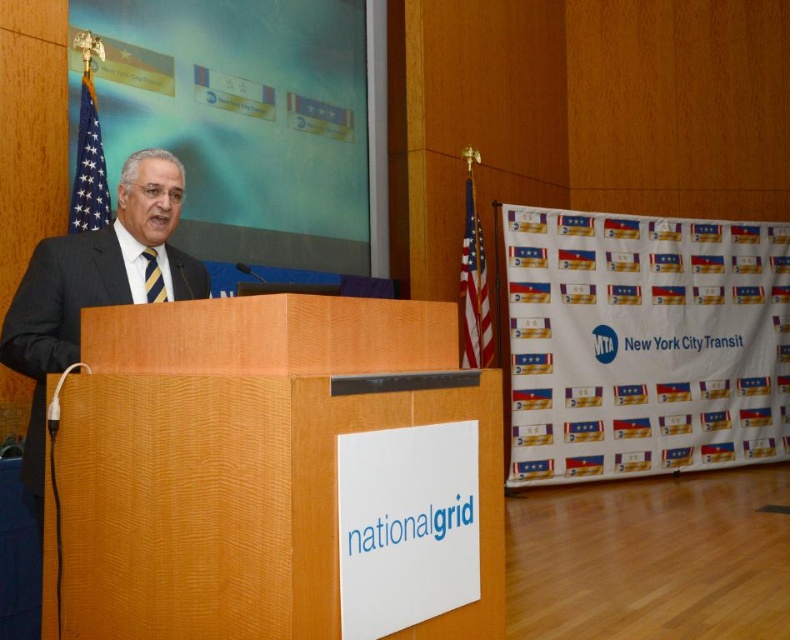
Who is shorter, matte black flag at upper left or striped silk tie at left?

Standing shorter between the two is striped silk tie at left.

Can you confirm if matte black flag at upper left is bigger than striped silk tie at left?

Yes, matte black flag at upper left is bigger than striped silk tie at left.

Does point (83, 173) come in front of point (151, 296)?

That is False.

You are a GUI agent. You are given a task and a screenshot of the screen. Output one action in this format:
    pyautogui.click(x=<x>, y=<y>)
    Task: Click on the matte black flag at upper left
    
    Given the screenshot: What is the action you would take?
    pyautogui.click(x=88, y=166)

Which of these two, wooden podium at center or striped silk tie at left, stands taller?

wooden podium at center is taller.

Does wooden podium at center have a larger size compared to striped silk tie at left?

Yes.

Does point (175, 378) lie behind point (149, 291)?

No.

The image size is (790, 640). I want to click on wooden podium at center, so click(x=275, y=474).

Does polished wood flag at right appear over matte black flag at upper left?

No, polished wood flag at right is not above matte black flag at upper left.

Does polished wood flag at right have a smaller size compared to matte black flag at upper left?

Incorrect, polished wood flag at right is not smaller in size than matte black flag at upper left.

Does point (465, 252) lie in front of point (85, 100)?

That is False.

Where is `polished wood flag at right`? This screenshot has width=790, height=640. polished wood flag at right is located at coordinates (474, 289).